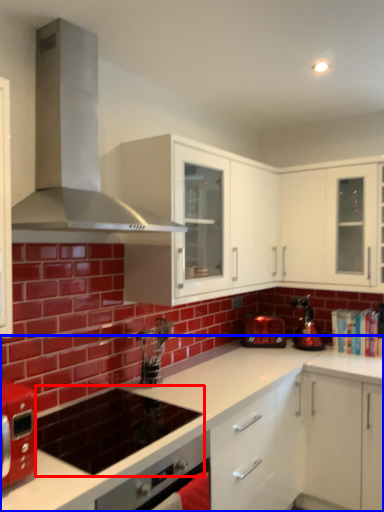
Question: Which point is further to the camera, appliance (highlighted by a red box) or countertop (highlighted by a blue box)?

Choices:
 (A) appliance
 (B) countertop

Answer: (A)